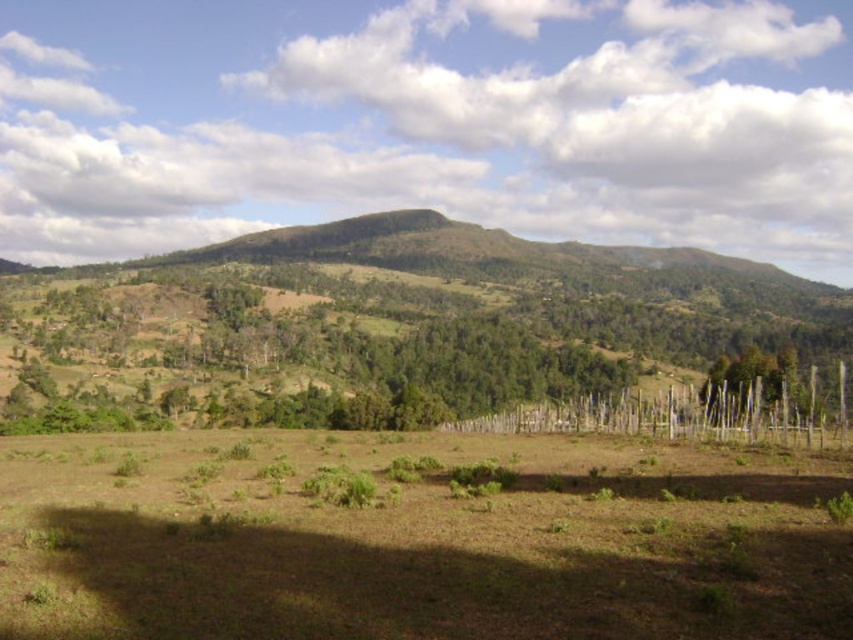
Can you confirm if green leafy trees at left is shorter than green wood fence at right?

Incorrect, green leafy trees at left's height does not fall short of green wood fence at right's.

Is green leafy trees at left to the right of green wood fence at right from the viewer's perspective?

Incorrect, green leafy trees at left is not on the right side of green wood fence at right.

This screenshot has width=853, height=640. Describe the element at coordinates (405, 337) in the screenshot. I see `green leafy trees at left` at that location.

Locate an element on the screen. This screenshot has width=853, height=640. green leafy trees at left is located at coordinates (405, 337).

Does brown grassy field at center appear under green leafy trees at left?

Indeed, brown grassy field at center is positioned under green leafy trees at left.

How far apart are brown grassy field at center and green leafy trees at left?

brown grassy field at center and green leafy trees at left are 624.55 feet apart.

Does point (740, 572) come in front of point (410, 360)?

That is True.

Identify the location of brown grassy field at center. Image resolution: width=853 pixels, height=640 pixels. (415, 541).

Is brown grassy field at center taller than green wood fence at right?

No, brown grassy field at center is not taller than green wood fence at right.

Which is behind, point (839, 588) or point (775, 388)?

Positioned behind is point (775, 388).

Identify the location of brown grassy field at center. (415, 541).